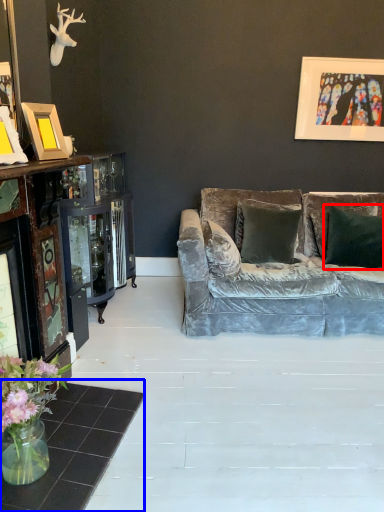
Question: Among these objects, which one is farthest to the camera, pillow (highlighted by a red box) or table (highlighted by a blue box)?

Choices:
 (A) pillow
 (B) table

Answer: (A)